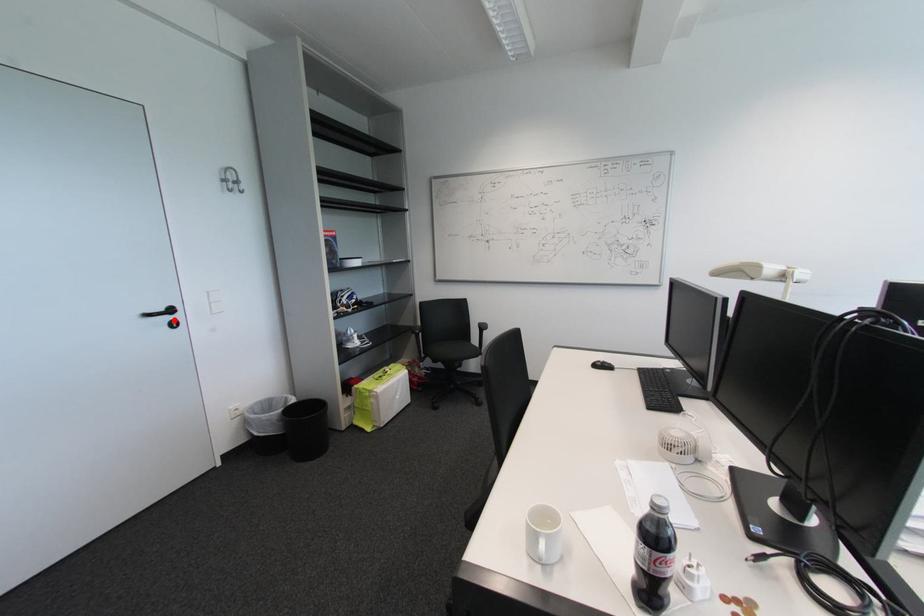
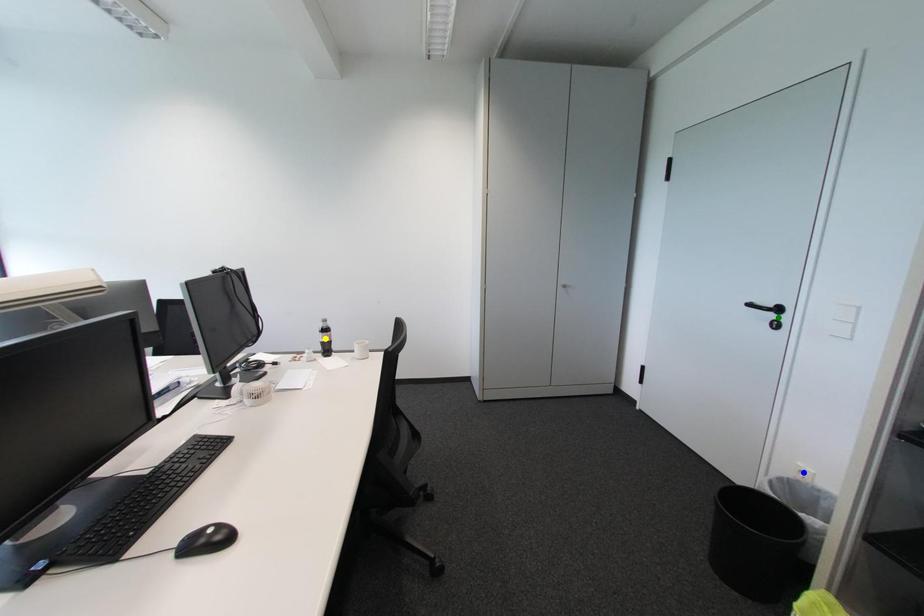
Question: I am providing you with two images of the same scene from different viewpoints. A red point is marked on the first image. You are given multiple points on the second image. Which spot in image 2 lines up with the point in image 1?

Choices:
 (A) yellow point
 (B) green point
 (C) blue point

Answer: (B)